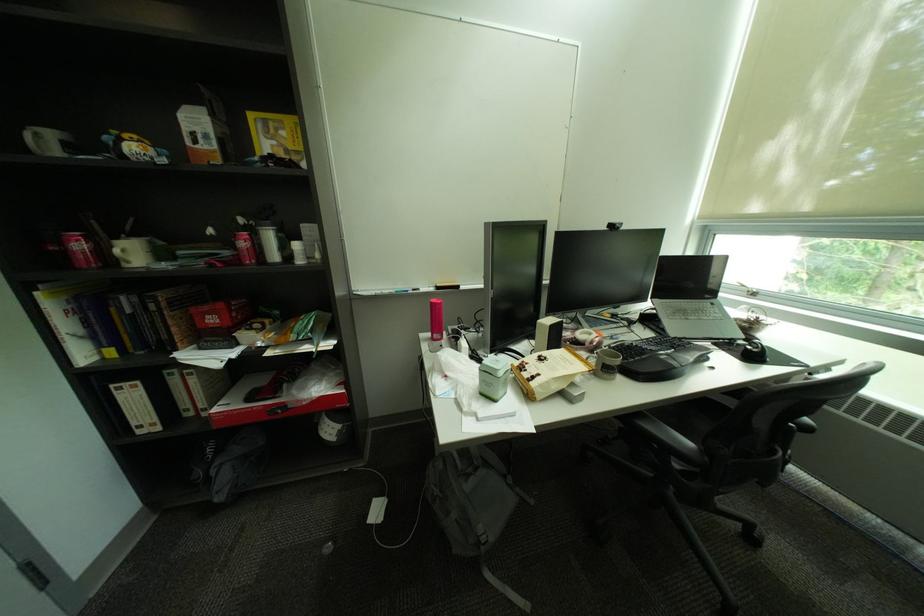
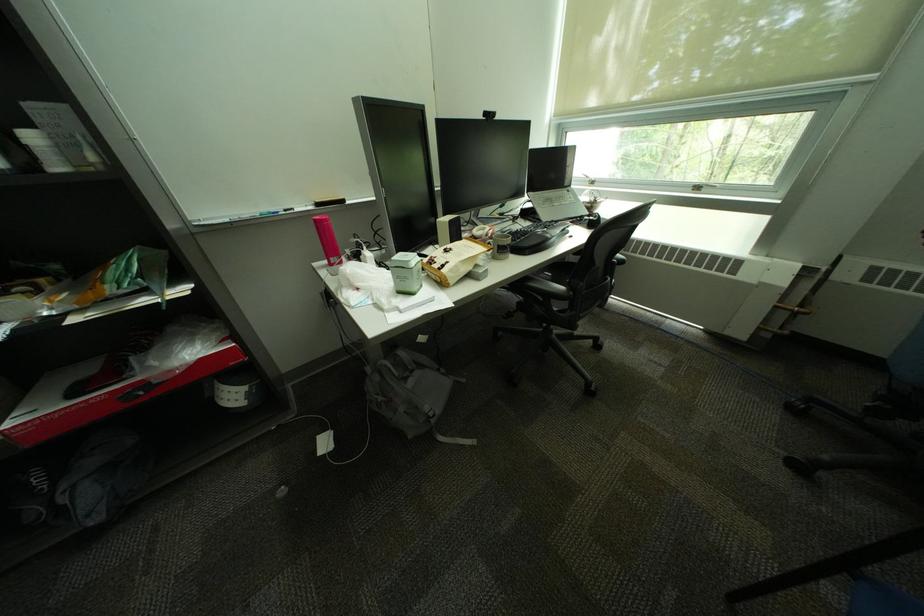
Based on the continuous images, in which direction is the camera rotating?

The camera's rotation is toward right-down.